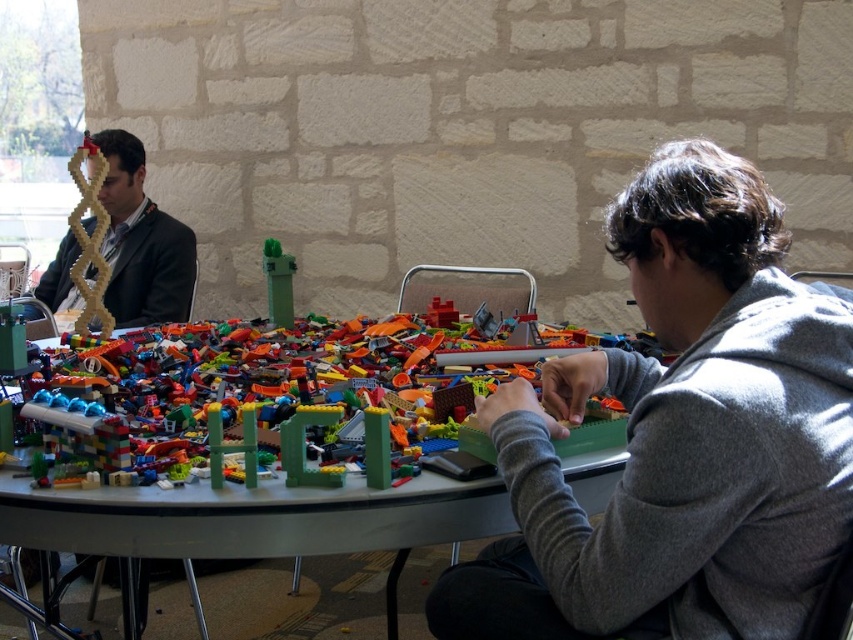
You are organizing a LEGO building activity and need to place the gray fleece at right and the translucent plastic lego bricks at center on a shelf. The shelf has limited space, and you want to ensure the larger item is placed first. Which item should you place first?

The translucent plastic lego bricks at center should be placed first because they are larger than the gray fleece at right.

You are organizing a workshop and need to place a name tag on the table. The name tag is wider than the matte black suit at left. Can you place it to the left of the multicolored plastic lego bricks at center without overlapping?

The multicolored plastic lego bricks at center is positioned on the right side of matte black suit at left, so placing the name tag to the left of the multicolored plastic lego bricks at center would require it to be between the matte black suit at left and the lego bricks. Since the name tag is wider than the matte black suit at left, it might not fit without overlapping if the space between them is smaller than the name tag.